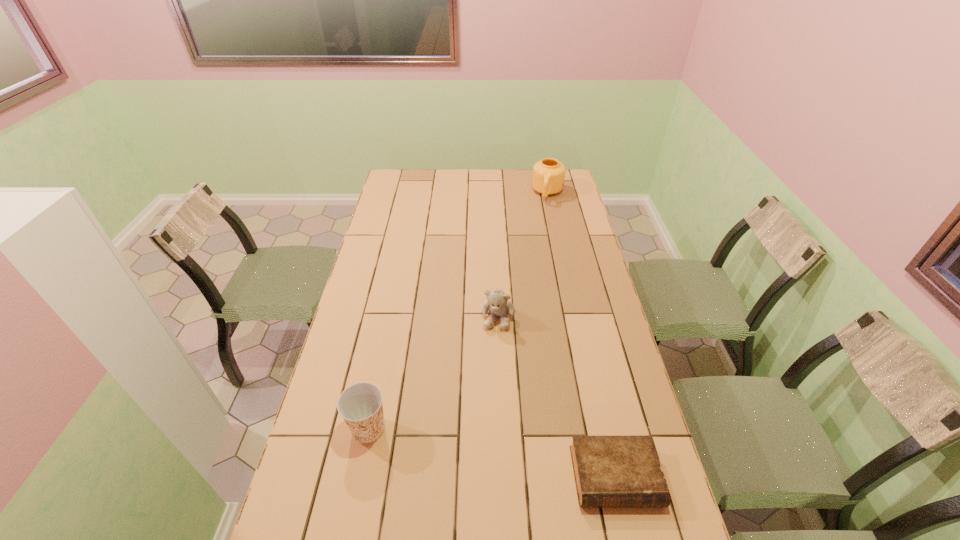
Find the location of a particular element. The image size is (960, 540). the leftmost object is located at coordinates (360, 405).

Where is `the shortest object`? the shortest object is located at coordinates (620, 471).

Locate an element on the screen. teddy bear is located at coordinates (497, 303).

Where is `the third object from right to left`? The image size is (960, 540). the third object from right to left is located at coordinates (497, 303).

Locate an element on the screen. The image size is (960, 540). the farthest object is located at coordinates (548, 177).

Find the location of a particular element. This screenshot has width=960, height=540. vacant space located 0.320m on the right of the leftmost object is located at coordinates (506, 429).

The image size is (960, 540). Identify the location of vacant space located on the spine side of the shortest object. (628, 534).

Where is `free space located on the face of the teddy bear`? The height and width of the screenshot is (540, 960). free space located on the face of the teddy bear is located at coordinates (493, 346).

I want to click on vacant region located 0.110m on the face of the teddy bear, so click(492, 359).

Identify the location of free space located on the face of the teddy bear. The height and width of the screenshot is (540, 960). (485, 397).